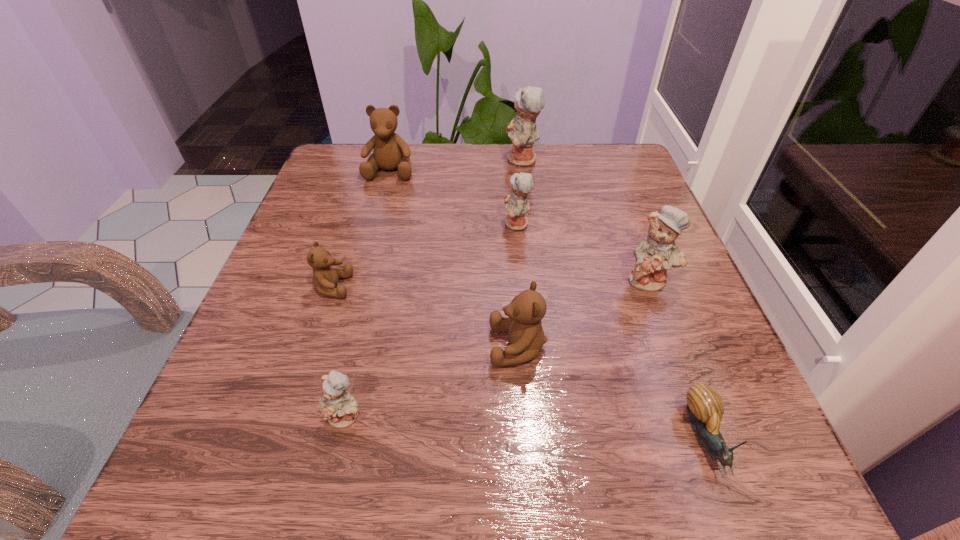
Locate an element on the screen. blank space located on the front-facing side of the third biggest blue teddy bear is located at coordinates (429, 224).

The image size is (960, 540). What are the coordinates of `vacant region located 0.130m on the front-facing side of the third nearest object` in the screenshot? It's located at click(x=406, y=346).

Locate an element on the screen. The image size is (960, 540). blank space located 0.240m on the front-facing side of the third nearest object is located at coordinates (335, 346).

You are a GUI agent. You are given a task and a screenshot of the screen. Output one action in this format:
    pyautogui.click(x=<x>, y=<y>)
    Task: Click on the free space located 0.120m on the front-facing side of the third nearest object
    
    Given the screenshot: What is the action you would take?
    pyautogui.click(x=412, y=346)

I want to click on free point located 0.120m on the front-facing side of the smallest brown teddy bear, so click(x=420, y=287).

In order to click on object at the near edge in this screenshot , I will do `click(705, 407)`.

Image resolution: width=960 pixels, height=540 pixels. I want to click on teddy bear located at the right edge, so click(x=659, y=252).

At what (x,y) coordinates should I click in order to perform the action: click on escargot located at the right edge. Please return your answer as a coordinate pair (x, y). Image resolution: width=960 pixels, height=540 pixels. Looking at the image, I should click on (705, 407).

This screenshot has width=960, height=540. Find the location of `object at the far left corner`. object at the far left corner is located at coordinates (391, 152).

I want to click on object present at the near right corner, so point(705,407).